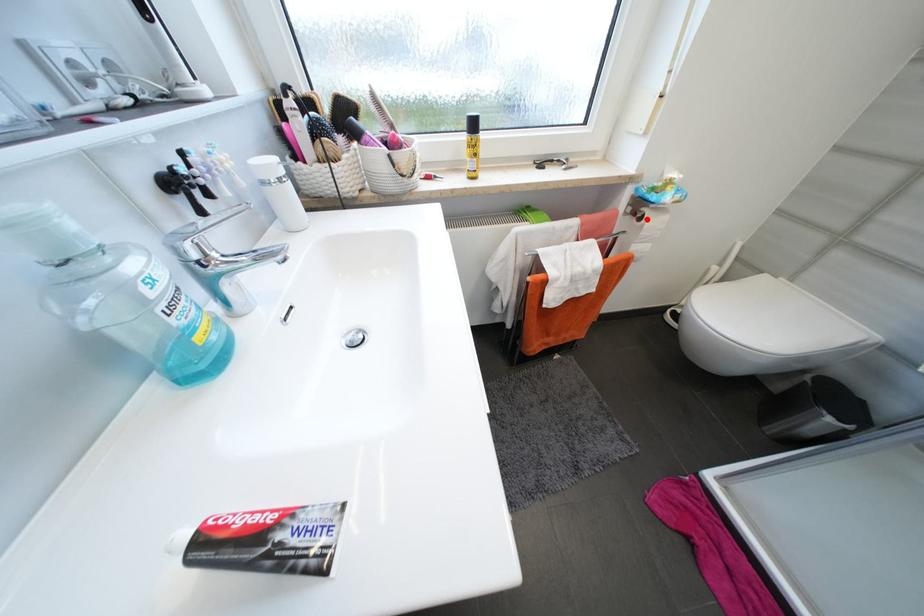
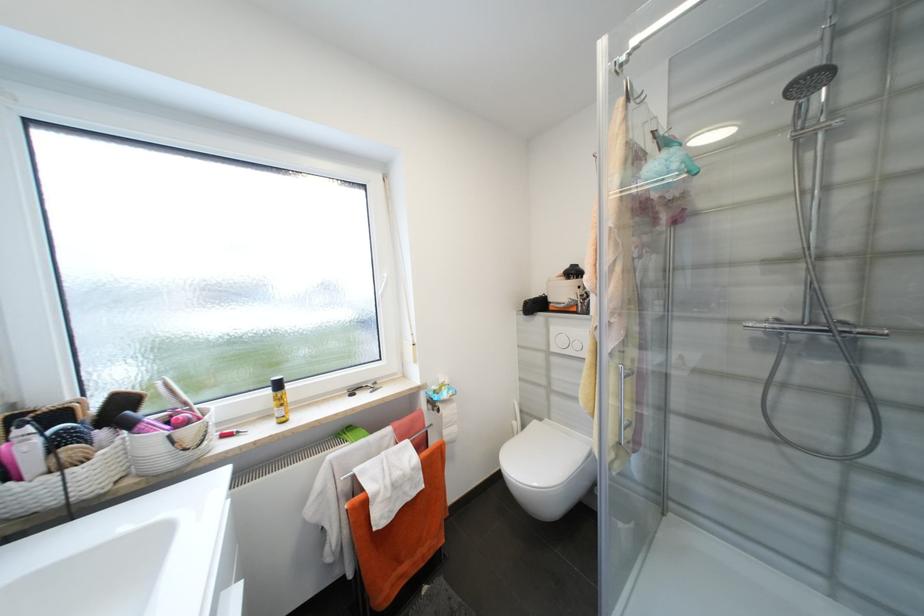
The point at the highlighted location is marked in the first image. Where is the corresponding point in the second image?

(444, 411)